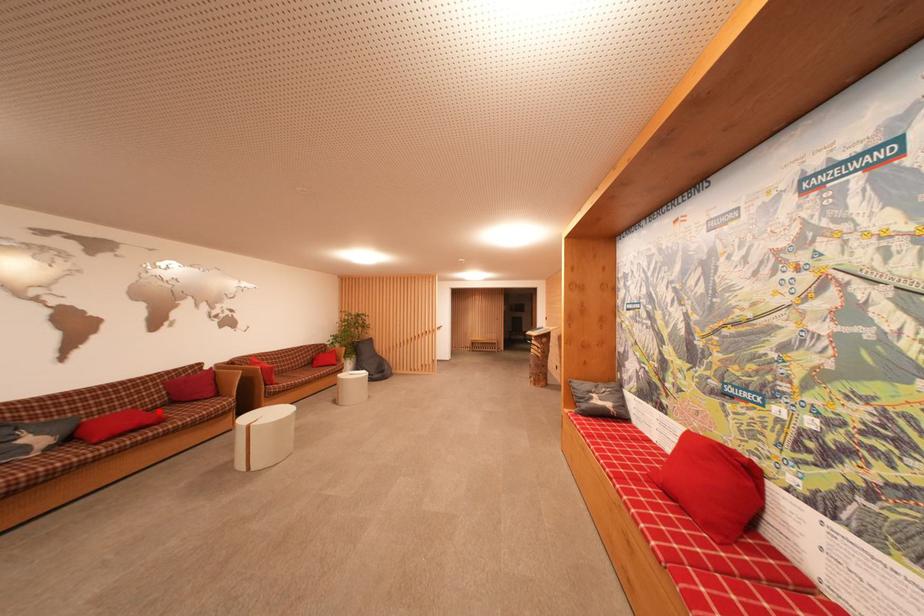
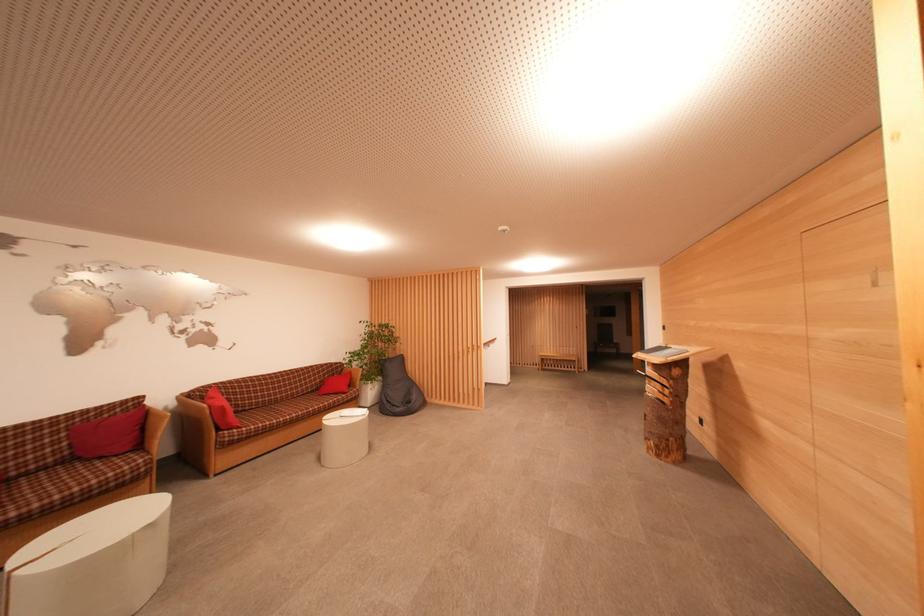
In the second image, find the point that corresponds to the highlighted location in the first image.

(45, 472)